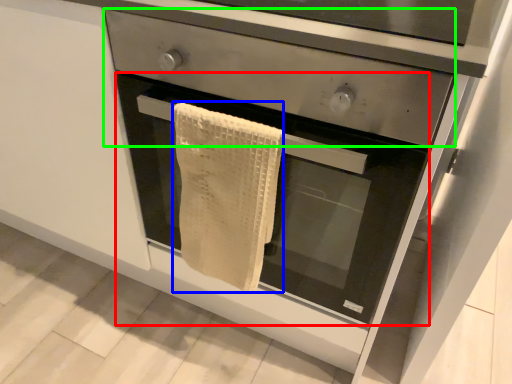
Question: Which is nearer to the oven (highlighted by a red box)? bath towel (highlighted by a blue box) or drawer (highlighted by a green box).

Choices:
 (A) bath towel
 (B) drawer

Answer: (A)